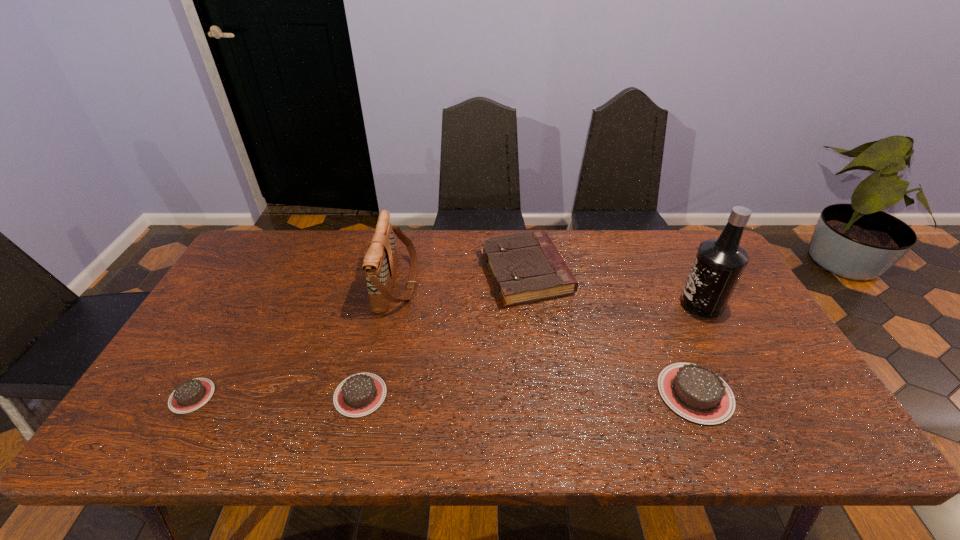
This screenshot has height=540, width=960. I want to click on vacant space located 0.340m on the back of the leftmost object, so click(x=254, y=287).

Image resolution: width=960 pixels, height=540 pixels. What are the coordinates of `vacant space located on the left of the second chocolate cake from left to right` in the screenshot? It's located at (227, 395).

Where is `vacant area situated on the left of the fourth tallest object`? The image size is (960, 540). vacant area situated on the left of the fourth tallest object is located at coordinates (564, 393).

This screenshot has width=960, height=540. In order to click on free space located on the front-facing side of the second tallest object in this screenshot , I will do `click(468, 284)`.

What are the coordinates of `free spot located on the right of the third object from right to left` in the screenshot? It's located at pyautogui.click(x=684, y=273).

You are a GUI agent. You are given a task and a screenshot of the screen. Output one action in this format:
    pyautogui.click(x=<x>, y=<y>)
    Task: Click on the vacant space situated on the front label of the liquor
    The height and width of the screenshot is (540, 960).
    Given the screenshot: What is the action you would take?
    [582, 303]

The width and height of the screenshot is (960, 540). What are the coordinates of `vacant space located on the front label of the liquor` in the screenshot? It's located at click(x=551, y=303).

Find the location of a particular element. This screenshot has height=540, width=960. vacant space situated on the front label of the liquor is located at coordinates (567, 303).

Where is `shoulder bag that is positioned at the far edge`? Image resolution: width=960 pixels, height=540 pixels. shoulder bag that is positioned at the far edge is located at coordinates (380, 262).

The height and width of the screenshot is (540, 960). Find the location of `hardback book that is at the far edge`. hardback book that is at the far edge is located at coordinates (526, 267).